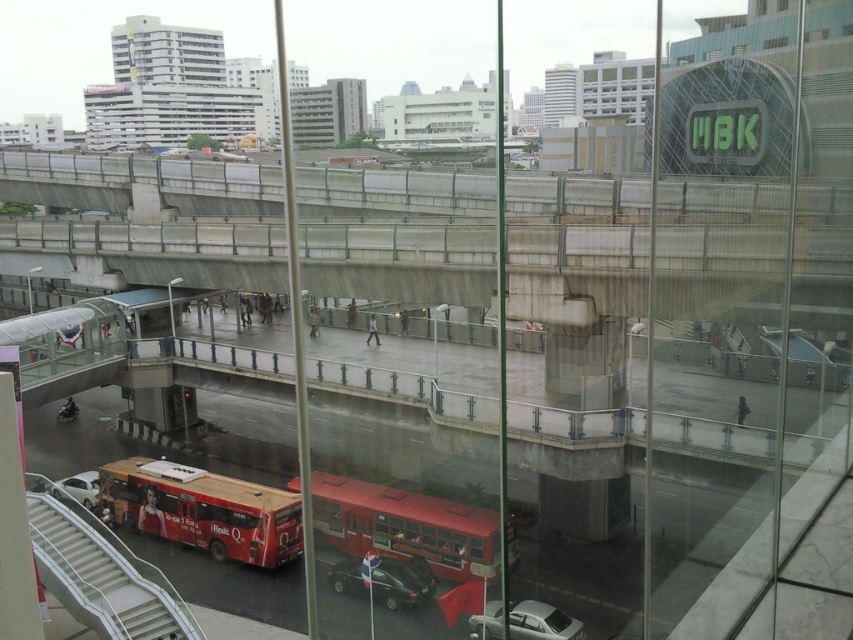
Between white plastic escalator at lower left and shiny red bus at center, which one has less height?

shiny red bus at center

Can you confirm if white plastic escalator at lower left is positioned to the right of shiny red bus at center?

No, white plastic escalator at lower left is not to the right of shiny red bus at center.

Who is more distant from viewer, (x=90, y=532) or (x=474, y=570)?

The point (x=474, y=570) is more distant.

Locate an element on the screen. Image resolution: width=853 pixels, height=640 pixels. white plastic escalator at lower left is located at coordinates (100, 572).

The width and height of the screenshot is (853, 640). Identify the location of red matte bus at lower left. (202, 509).

Which of these two, red matte bus at lower left or white plastic escalator at lower left, stands shorter?

red matte bus at lower left

In order to click on red matte bus at lower left in this screenshot , I will do `click(202, 509)`.

You are a GUI agent. You are given a task and a screenshot of the screen. Output one action in this format:
    pyautogui.click(x=<x>, y=<y>)
    Task: Click on the red matte bus at lower left
    
    Given the screenshot: What is the action you would take?
    pyautogui.click(x=202, y=509)

Which is above, red matte bus at lower left or shiny red bus at center?

red matte bus at lower left

Between point (236, 508) and point (293, 477), which one is positioned behind?

Positioned behind is point (293, 477).

Is point (260, 563) less distant than point (396, 536)?

No, (260, 563) is behind (396, 536).

Find the location of a particular element. This screenshot has height=640, width=853. red matte bus at lower left is located at coordinates (202, 509).